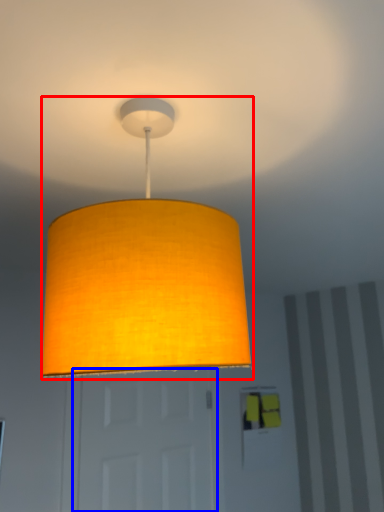
Question: Which of the following is the closest to the observer, lamp (highlighted by a red box) or door (highlighted by a blue box)?

Choices:
 (A) lamp
 (B) door

Answer: (A)